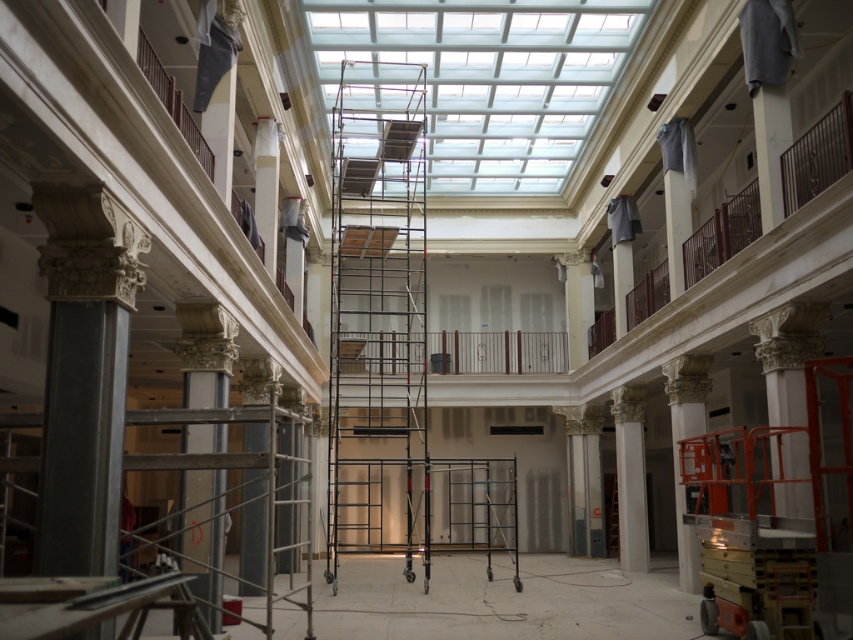
Who is positioned more to the right, white marble column at lower left or white marble column at right?

From the viewer's perspective, white marble column at right appears more on the right side.

Does white marble column at lower left lie in front of white marble column at right?

Yes, white marble column at lower left is in front of white marble column at right.

The height and width of the screenshot is (640, 853). What are the coordinates of `white marble column at lower left` in the screenshot? It's located at (206, 353).

I want to click on white marble pillar at center, so click(x=630, y=476).

The height and width of the screenshot is (640, 853). What do you see at coordinates (630, 476) in the screenshot?
I see `white marble pillar at center` at bounding box center [630, 476].

Identify the location of white marble pillar at center. The width and height of the screenshot is (853, 640). (630, 476).

Does black metal scaffolding at center have a greater width compared to white marble pillar at center?

Yes, black metal scaffolding at center is wider than white marble pillar at center.

Which is behind, point (361, 435) or point (645, 509)?

Point (645, 509)

Identify the location of black metal scaffolding at center. (376, 314).